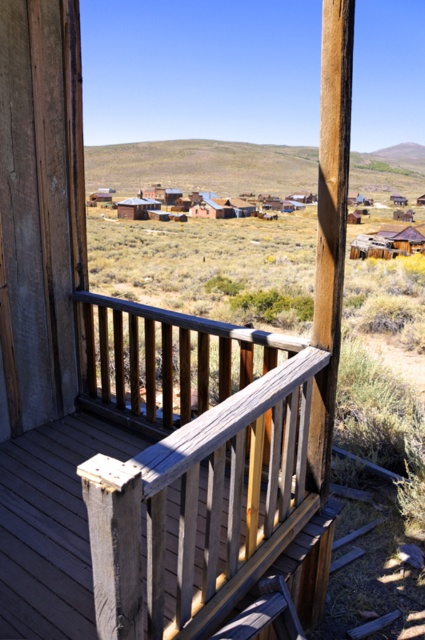
Question: Is weathered wood rail at center above wooden hut at center?

Choices:
 (A) no
 (B) yes

Answer: (A)

Question: Considering the real-world distances, which object is closest to the wooden hut at center?

Choices:
 (A) rustic wooden hut at center
 (B) weathered wood rail at center

Answer: (B)

Question: Which point is closer to the camera?

Choices:
 (A) rustic wooden hut at center
 (B) wooden hut at center

Answer: (B)

Question: Is wooden hut at center positioned behind rustic wooden hut at center?

Choices:
 (A) yes
 (B) no

Answer: (B)

Question: Can you confirm if weathered wood rail at center is positioned to the right of wooden hut at center?

Choices:
 (A) no
 (B) yes

Answer: (A)

Question: Among these objects, which one is nearest to the camera?

Choices:
 (A) weathered wood rail at center
 (B) wooden hut at center

Answer: (A)